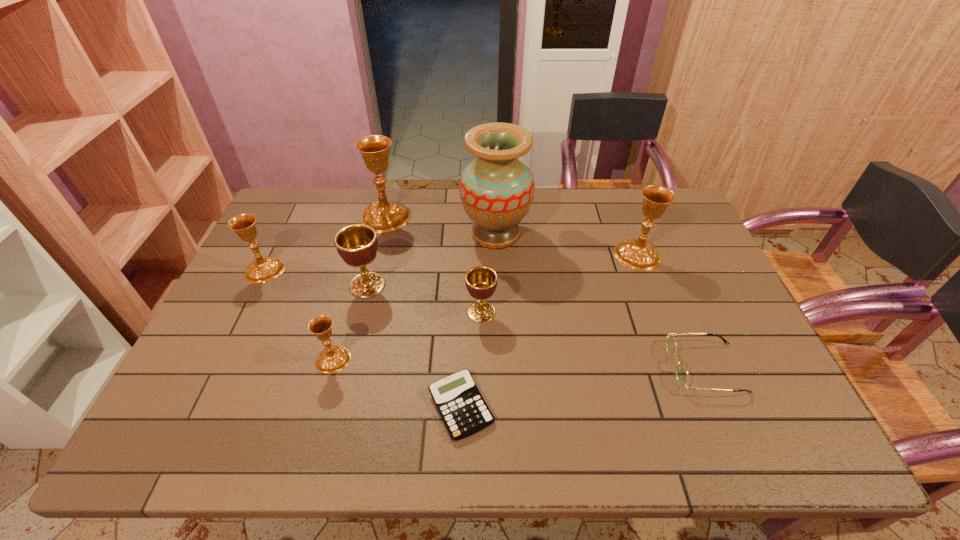
Where is `the nearer golden chalice`? The height and width of the screenshot is (540, 960). the nearer golden chalice is located at coordinates (481, 281).

Locate an element on the screen. The width and height of the screenshot is (960, 540). the smallest gold chalice is located at coordinates (334, 358).

The image size is (960, 540). I want to click on the nearest gold chalice, so click(x=334, y=358).

At what (x,y) coordinates should I click in order to perform the action: click on green spectacles. Please return your answer as a coordinate pair (x, y). The image size is (960, 540). Looking at the image, I should click on (681, 372).

Find the location of a particular element. spectacles is located at coordinates (681, 372).

At what (x,y) coordinates should I click in order to perform the action: click on calculator. Please return your answer as a coordinate pair (x, y). Looking at the image, I should click on (460, 404).

Identify the location of free space located on the left of the vase. (399, 234).

Locate an element on the screen. This screenshot has width=960, height=540. vacant space located 0.220m on the right of the farthest chalice is located at coordinates (476, 217).

Find the location of `free space located on the front of the rightmost gold chalice`. free space located on the front of the rightmost gold chalice is located at coordinates (650, 288).

The height and width of the screenshot is (540, 960). What are the coordinates of `vacant region located 0.310m on the right of the second smallest gold chalice` in the screenshot? It's located at (390, 270).